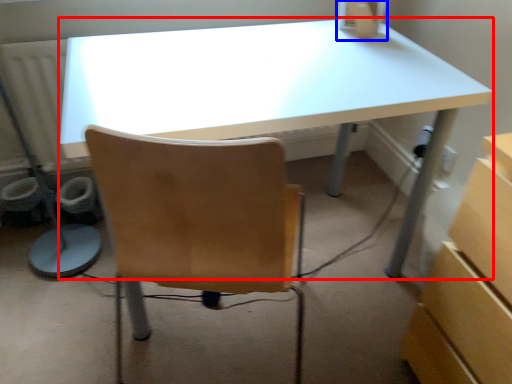
Question: Which of the following is the farthest to the observer, desk (highlighted by a red box) or desktop computer (highlighted by a blue box)?

Choices:
 (A) desk
 (B) desktop computer

Answer: (B)